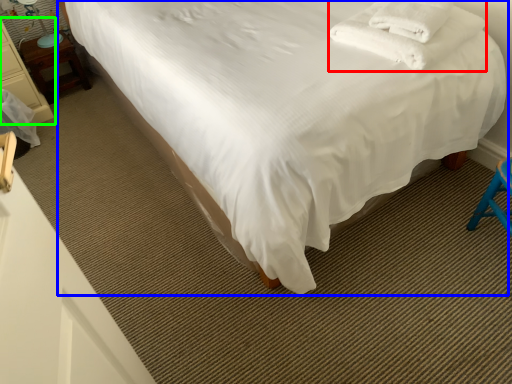
Question: Which is farther away from blanket (highlighted by a red box)? bed (highlighted by a blue box) or furniture (highlighted by a green box)?

Choices:
 (A) bed
 (B) furniture

Answer: (B)